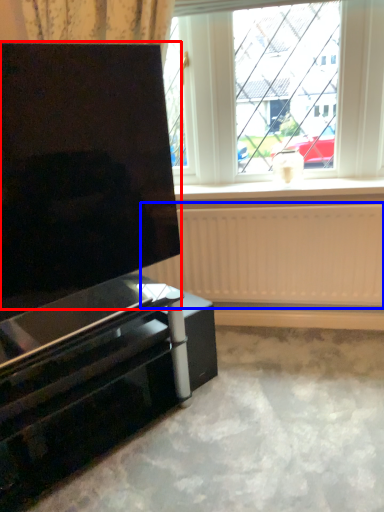
Question: Which object is closer to the camera taking this photo, screen (highlighted by a red box) or radiator (highlighted by a blue box)?

Choices:
 (A) screen
 (B) radiator

Answer: (A)